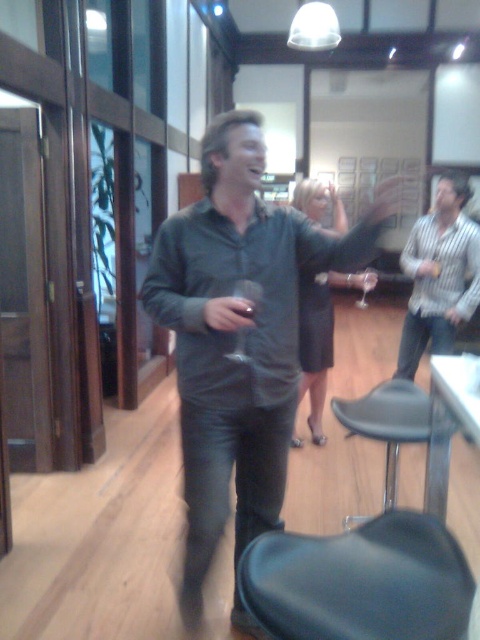
Is black leather chair at lower center to the right of striped cotton shirt at upper right from the viewer's perspective?

No, black leather chair at lower center is not to the right of striped cotton shirt at upper right.

Between black leather chair at lower center and striped cotton shirt at upper right, which one has more height?

striped cotton shirt at upper right

Is point (272, 582) closer to viewer compared to point (450, 243)?

Yes, point (272, 582) is in front of point (450, 243).

I want to click on black leather chair at lower center, so click(x=360, y=580).

Does transparent plastic wine glass at center have a lesser width compared to transparent glass at center?

Correct, transparent plastic wine glass at center's width is less than transparent glass at center's.

Does transparent plastic wine glass at center have a smaller size compared to transparent glass at center?

Indeed, transparent plastic wine glass at center has a smaller size compared to transparent glass at center.

Find the location of a particular element. transparent plastic wine glass at center is located at coordinates (249, 294).

Where is `transparent plastic wine glass at center`? The width and height of the screenshot is (480, 640). transparent plastic wine glass at center is located at coordinates (249, 294).

Is matte gray shirt at center smaller than striped cotton shirt at upper right?

Actually, matte gray shirt at center might be larger than striped cotton shirt at upper right.

Which is behind, point (261, 157) or point (455, 278)?

Positioned behind is point (455, 278).

Identify the location of matte gray shirt at center. The image size is (480, 640). (235, 339).